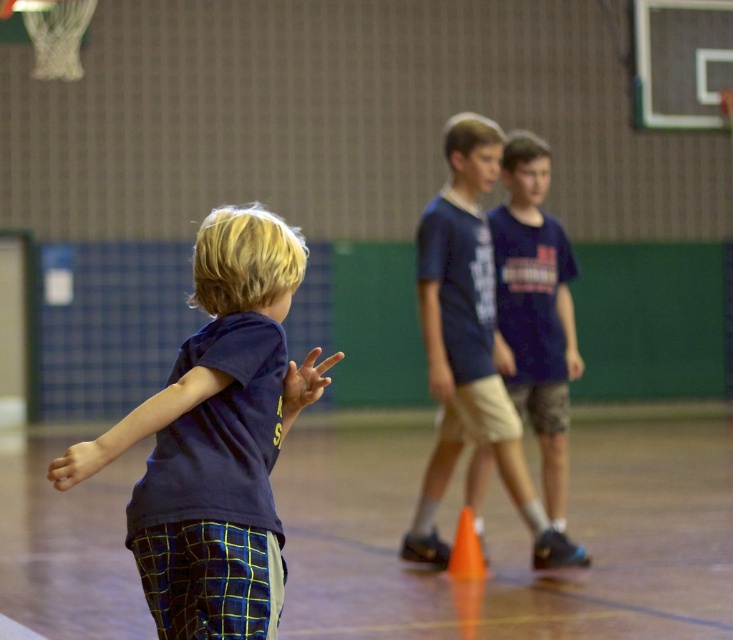
You are a gym teacher observing a child in the center of the court wearing a navy blue shirt and standing next to an orange matte cone. Which object is taller, the navy blue shirt at center or the orange matte cone at center?

The navy blue shirt at center is much taller than the orange matte cone at center.